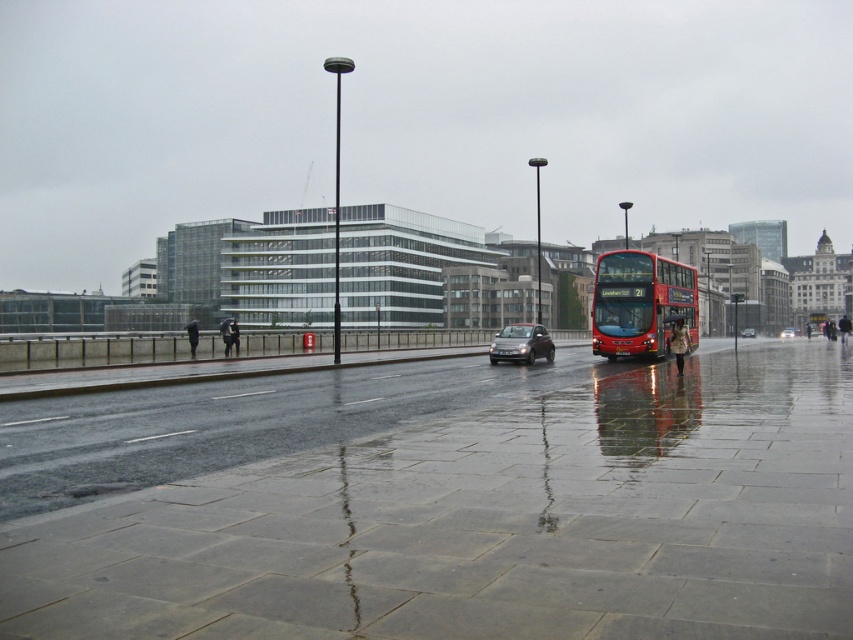
You are a pedestrian standing on the wet pavement and see both the shiny silver car at center and the shiny black car at center. Which car is taller?

The shiny silver car at center is taller than the shiny black car at center.

You are a delivery person needing to place a 2.5 meter long package horizontally on the pavement between the metallic bus stop at center and the shiny silver car at center. Is there enough space?

The metallic bus stop at center is narrower than the shiny silver car at center, but the exact distance between them isn not provided in the scene description. Therefore, it is impossible to determine if there is enough space for the 2.5 meter long package.

You are a pedestrian standing at the point labeled as point (746, 316) in the image. What object are you standing at?

The point (746, 316) corresponds to the metallic bus stop at center, so you are standing at the metallic bus stop at center.